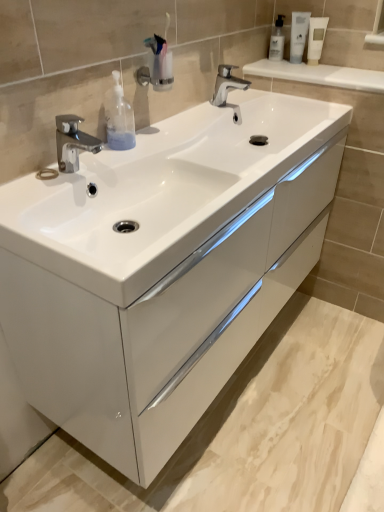
At what (x,y) coordinates should I click in order to perform the action: click on vacant space in front of clear plastic bottle at upper right, which ranks as the 3th mouthwash in right-to-left order. Please return your answer as a coordinate pair (x, y). Looking at the image, I should click on (275, 71).